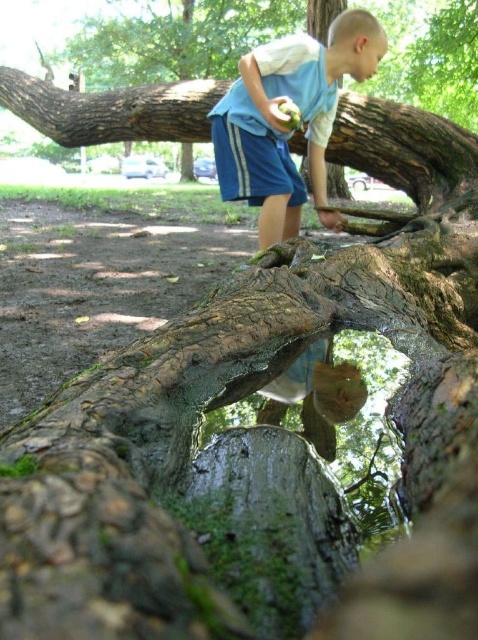
Question: Which point is farther to the camera?

Choices:
 (A) pos(469,8)
 (B) pos(328,131)

Answer: (A)

Question: Does blue cotton shorts at center lie in front of rough bark tree trunk at upper center?

Choices:
 (A) yes
 (B) no

Answer: (A)

Question: Which object appears farthest from the camera in this image?

Choices:
 (A) blue cotton shorts at center
 (B) rough bark tree trunk at upper center

Answer: (B)

Question: Can you confirm if blue cotton shorts at center is bigger than rough bark tree trunk at upper center?

Choices:
 (A) yes
 (B) no

Answer: (B)

Question: Can you confirm if blue cotton shorts at center is positioned to the left of rough bark tree trunk at upper center?

Choices:
 (A) yes
 (B) no

Answer: (B)